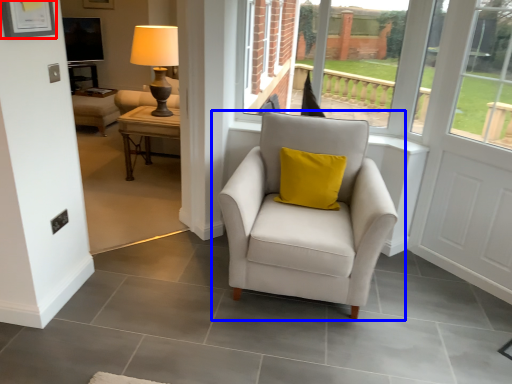
Question: Among these objects, which one is farthest to the camera, picture frame (highlighted by a red box) or chair (highlighted by a blue box)?

Choices:
 (A) picture frame
 (B) chair

Answer: (B)